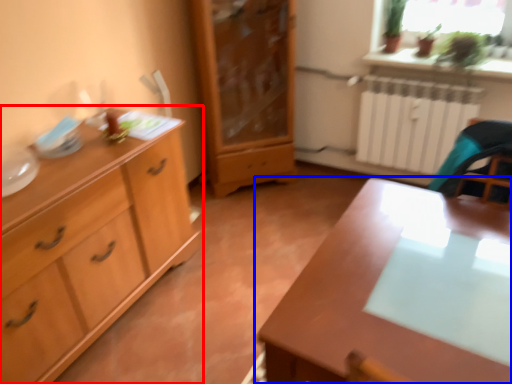
Question: Which object appears farthest to the camera in this image, chest of drawers (highlighted by a red box) or table (highlighted by a blue box)?

Choices:
 (A) chest of drawers
 (B) table

Answer: (A)